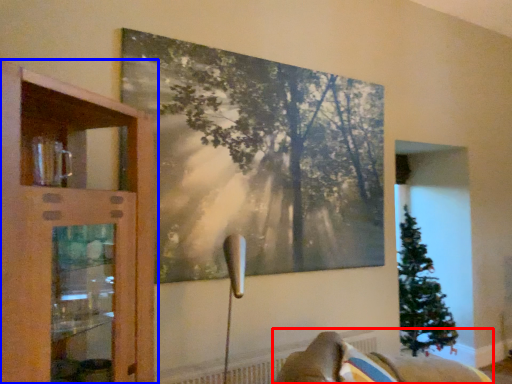
Question: Among these objects, which one is farthest to the camera, furniture (highlighted by a red box) or cupboard (highlighted by a blue box)?

Choices:
 (A) furniture
 (B) cupboard

Answer: (A)